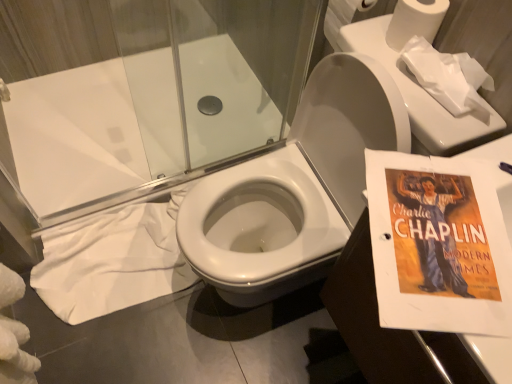
Image resolution: width=512 pixels, height=384 pixels. In order to click on free region under white fabric at lower left (from a real-world perspective) in this screenshot , I will do `click(104, 259)`.